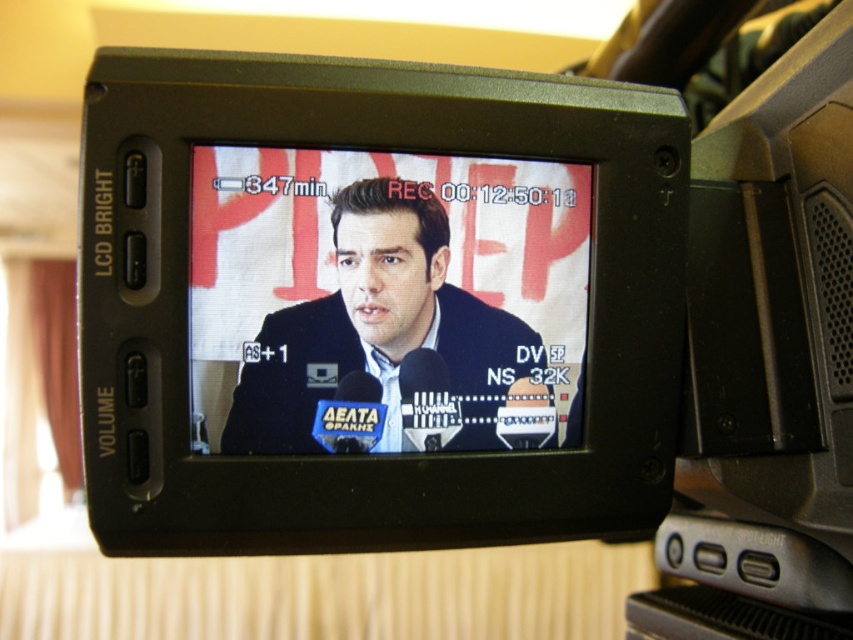
Question: Which point is closer to the camera taking this photo?

Choices:
 (A) (679, 227)
 (B) (335, 330)

Answer: (B)

Question: Is black plastic camera at center further to the viewer compared to matte black suit at center?

Choices:
 (A) yes
 (B) no

Answer: (B)

Question: Which object appears closest to the camera in this image?

Choices:
 (A) black plastic camera at center
 (B) matte black suit at center

Answer: (A)

Question: Can you confirm if black plastic camera at center is positioned to the right of matte black suit at center?

Choices:
 (A) no
 (B) yes

Answer: (B)

Question: Can you confirm if black plastic camera at center is positioned above matte black suit at center?

Choices:
 (A) yes
 (B) no

Answer: (A)

Question: Which point is closer to the camera taking this photo?

Choices:
 (A) (457, 332)
 (B) (363, 280)

Answer: (B)